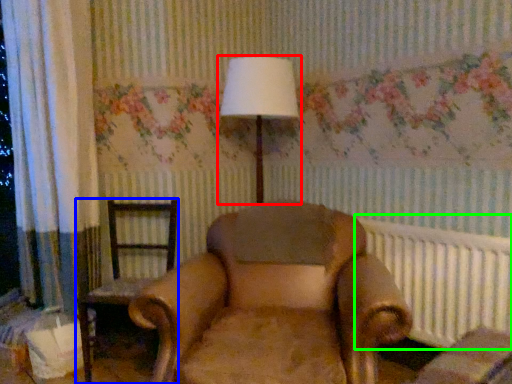
Question: Considering the real-world distances, which object is closest to lamp (highlighted by a red box)? chair (highlighted by a blue box) or radiator (highlighted by a green box).

Choices:
 (A) chair
 (B) radiator

Answer: (A)